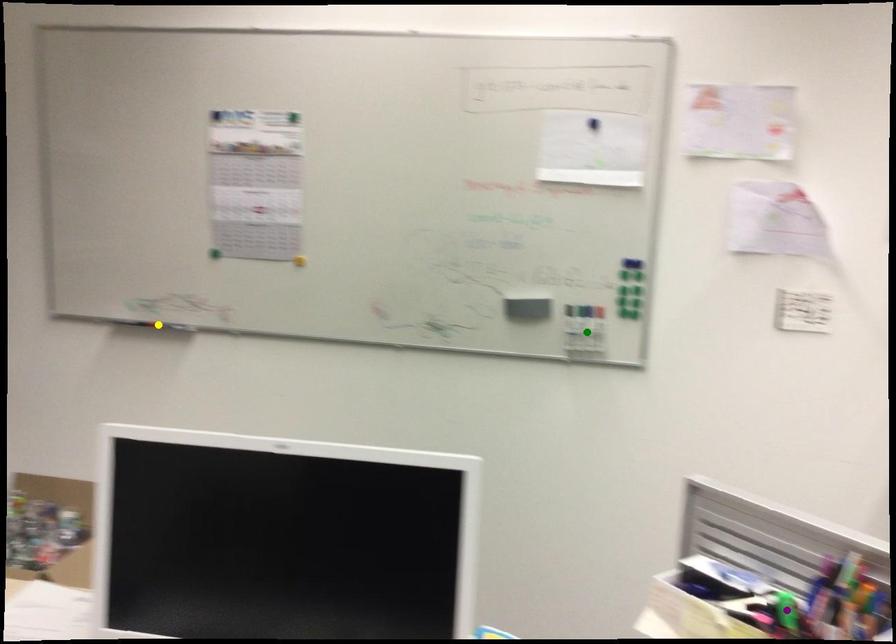
Order these from nearest to farthest:
A) yellow point
B) purple point
C) green point

yellow point → green point → purple point